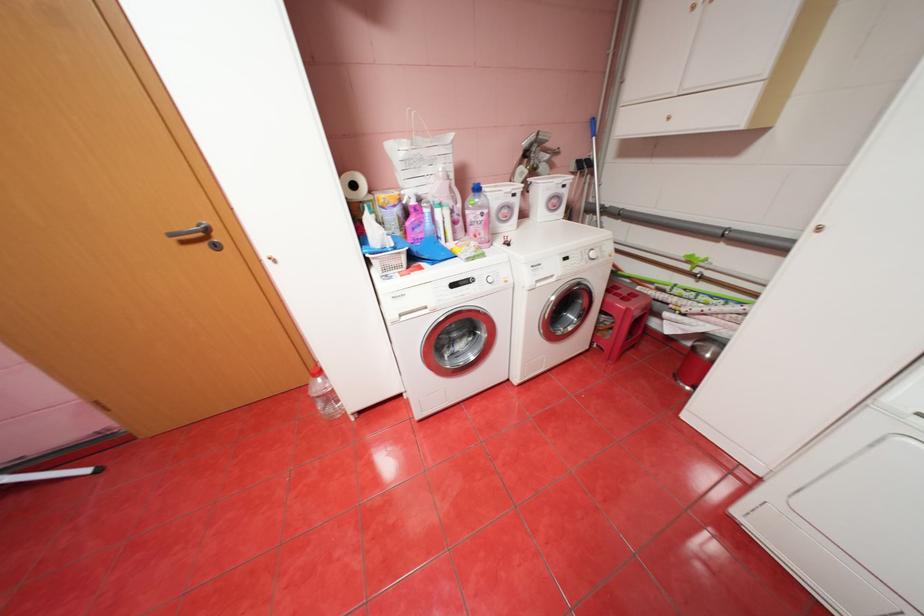
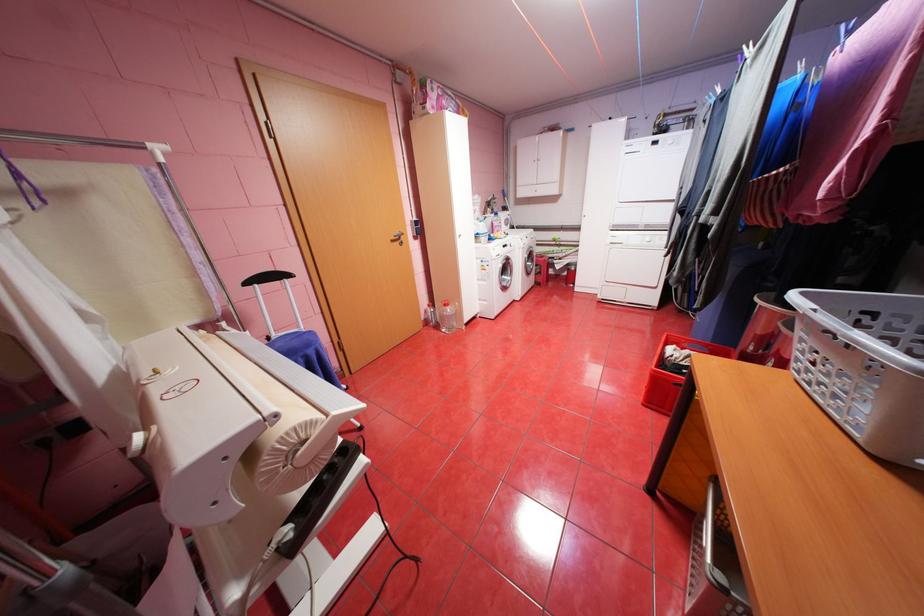
Locate, in the second image, the point that corresponds to the point at 191,241 in the first image.

(400, 241)